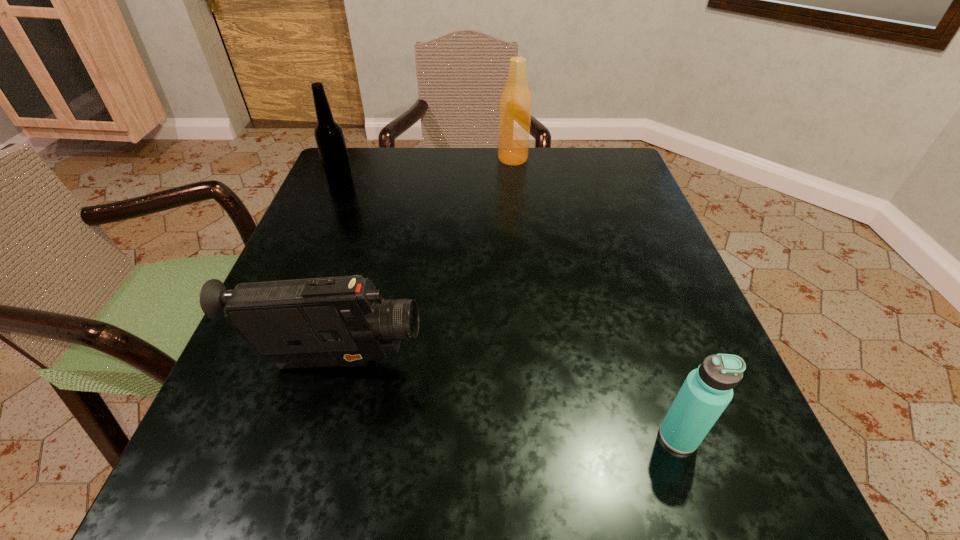
Find the location of a particular element. The height and width of the screenshot is (540, 960). vacant space located 0.210m on the back of the nearest object is located at coordinates (634, 305).

Identify the location of object that is at the near edge. The height and width of the screenshot is (540, 960). (706, 392).

Locate an element on the screen. The image size is (960, 540). beer bottle that is at the left edge is located at coordinates (329, 136).

Locate an element on the screen. The height and width of the screenshot is (540, 960). camcorder at the left edge is located at coordinates (331, 321).

Locate an element on the screen. This screenshot has height=540, width=960. object that is at the right edge is located at coordinates (706, 392).

Image resolution: width=960 pixels, height=540 pixels. Find the location of `object at the far left corner`. object at the far left corner is located at coordinates (329, 136).

The height and width of the screenshot is (540, 960). In order to click on object that is positioned at the near right corner in this screenshot , I will do `click(706, 392)`.

The height and width of the screenshot is (540, 960). In order to click on vacant region at the far edge of the desktop in this screenshot , I will do `click(499, 176)`.

Locate an element on the screen. The width and height of the screenshot is (960, 540). vacant region at the near edge of the desktop is located at coordinates (348, 497).

At what (x,y) coordinates should I click in order to perform the action: click on blank space at the left edge of the desktop. Please return your answer as a coordinate pair (x, y). Looking at the image, I should click on (321, 215).